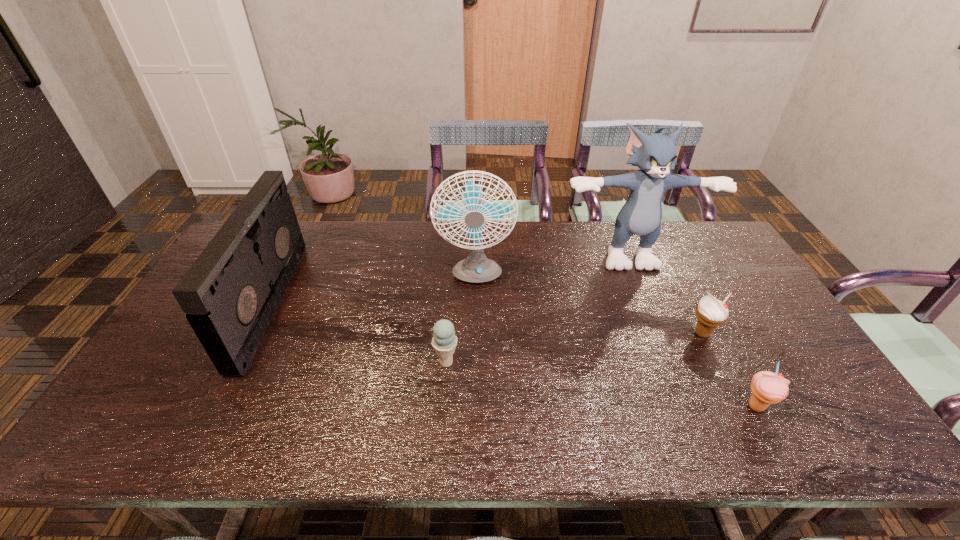
This screenshot has height=540, width=960. What are the coordinates of `free space between the leftmost icecream and the farthest icecream` in the screenshot? It's located at (574, 348).

I want to click on empty location between the nearest object and the leftmost icecream, so click(601, 384).

Where is `vacant area that lies between the second nearest icecream and the nearest object`? vacant area that lies between the second nearest icecream and the nearest object is located at coordinates (601, 384).

Where is `object that stands as the closest to the second nearest icecream`? The height and width of the screenshot is (540, 960). object that stands as the closest to the second nearest icecream is located at coordinates (476, 268).

Locate an element on the screen. object identified as the fifth closest to the second nearest icecream is located at coordinates (768, 388).

Identify the location of the closest icecream to the nearest icecream. (711, 313).

Select which icecream appears as the closest to the cat. Please provide its 2D coordinates. Your answer should be formatted as a tuple, i.e. [(x, y)], where the tuple contains the x and y coordinates of a point satisfying the conditions above.

[(711, 313)]

You are a GUI agent. You are given a task and a screenshot of the screen. Output one action in this format:
    pyautogui.click(x=<x>, y=<y>)
    Task: Click on the free space that satisfies the following two spatial constraints: 1. on the front side of the videotape; 2. on the back side of the farthest icecream
    
    Given the screenshot: What is the action you would take?
    pyautogui.click(x=254, y=334)

The image size is (960, 540). What are the coordinates of `free space that satisfies the following two spatial constraints: 1. on the front side of the leftmost object; 2. on the back side of the farthest icecream` in the screenshot? It's located at (254, 334).

Where is `free space that satisfies the following two spatial constraints: 1. on the front-facing side of the cat; 2. on the front side of the fourth shortest object`? free space that satisfies the following two spatial constraints: 1. on the front-facing side of the cat; 2. on the front side of the fourth shortest object is located at coordinates (647, 303).